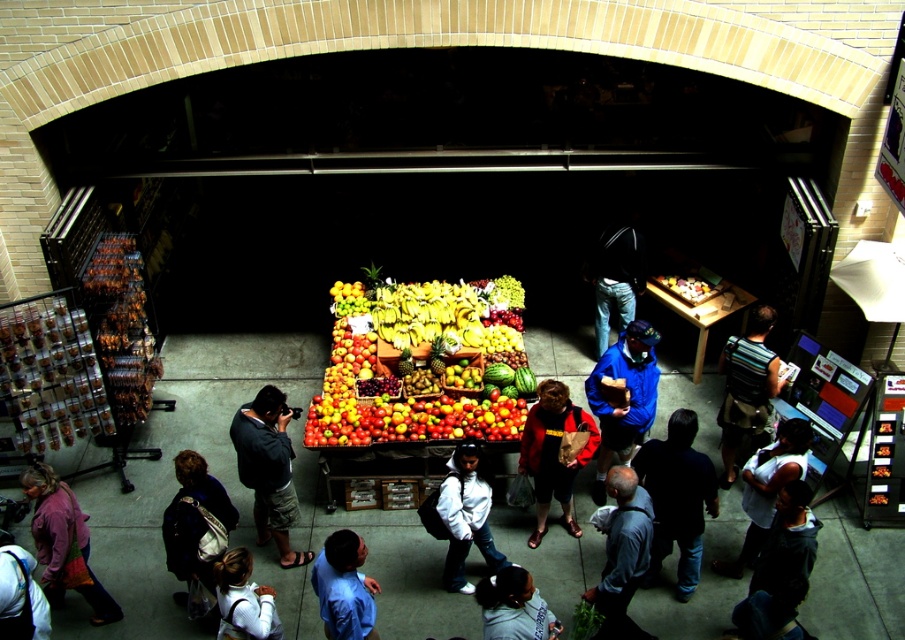
Consider the image. You are a vendor at the fruit stand and need to determine if you can fit both the red jacket at center and the white matte shirt at lower left into a storage box that is 1 meter wide. Based on their widths, can both items fit side by side?

The red jacket at center might be wider than the white matte shirt at lower left, so there is uncertainty if both can fit side by side in the 1 meter wide storage box. The combined width of both items could exceed the box capacity.

You are a delivery person carrying a heavy box and need to navigate through the market to reach the exit located near the fruit stand. Considering the space between the blue cotton shirt at center and the dark blue jacket at lower left, can you pass through without bumping into anyone?

The distance between the blue cotton shirt at center and the dark blue jacket at lower left is 10.95 feet, which is more than enough space for a delivery person carrying a box to pass through safely without bumping into anyone.